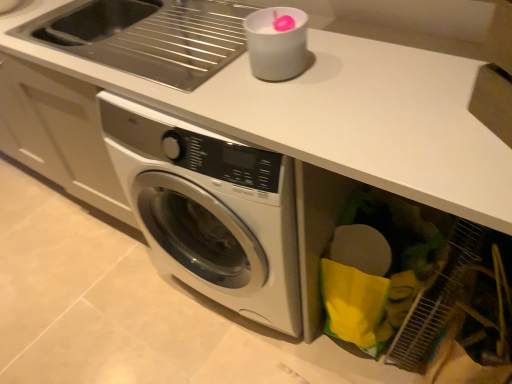
Question: From the image's perspective, would you say stainless steel sink at upper left is shown under white plastic cup at upper center?

Choices:
 (A) no
 (B) yes

Answer: (A)

Question: Are stainless steel sink at upper left and white plastic cup at upper center making contact?

Choices:
 (A) no
 (B) yes

Answer: (A)

Question: Considering the relative sizes of stainless steel sink at upper left and white plastic cup at upper center in the image provided, is stainless steel sink at upper left bigger than white plastic cup at upper center?

Choices:
 (A) yes
 (B) no

Answer: (A)

Question: Does stainless steel sink at upper left have a greater width compared to white plastic cup at upper center?

Choices:
 (A) no
 (B) yes

Answer: (B)

Question: Does stainless steel sink at upper left have a greater height compared to white plastic cup at upper center?

Choices:
 (A) no
 (B) yes

Answer: (B)

Question: Is stainless steel sink at upper left to the left of white plastic cup at upper center from the viewer's perspective?

Choices:
 (A) yes
 (B) no

Answer: (A)

Question: Considering the relative sizes of white plastic cup at upper center and stainless steel sink at upper left in the image provided, is white plastic cup at upper center wider than stainless steel sink at upper left?

Choices:
 (A) no
 (B) yes

Answer: (A)

Question: From the image's perspective, is white plastic cup at upper center located above stainless steel sink at upper left?

Choices:
 (A) yes
 (B) no

Answer: (B)

Question: Is stainless steel sink at upper left at the back of white plastic cup at upper center?

Choices:
 (A) no
 (B) yes

Answer: (A)

Question: Is white plastic cup at upper center aimed at stainless steel sink at upper left?

Choices:
 (A) yes
 (B) no

Answer: (B)

Question: Is white plastic cup at upper center further to the viewer compared to stainless steel sink at upper left?

Choices:
 (A) yes
 (B) no

Answer: (B)

Question: Can you confirm if white plastic cup at upper center is thinner than stainless steel sink at upper left?

Choices:
 (A) yes
 (B) no

Answer: (A)

Question: Is point (295, 13) positioned closer to the camera than point (176, 18)?

Choices:
 (A) closer
 (B) farther

Answer: (A)